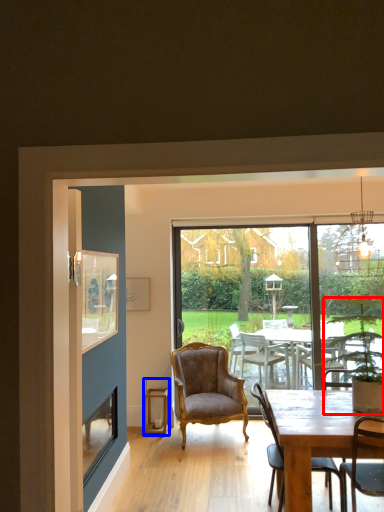
Question: Which object appears farthest to the camera in this image, houseplant (highlighted by a red box) or lantern (highlighted by a blue box)?

Choices:
 (A) houseplant
 (B) lantern

Answer: (B)